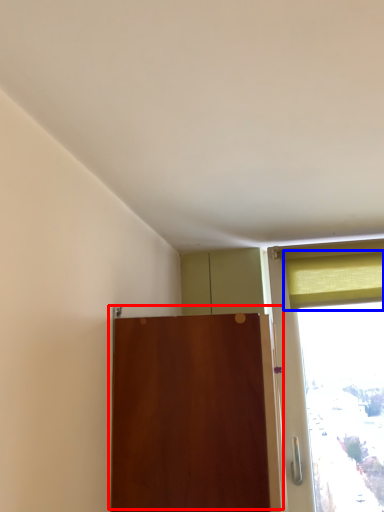
Question: Which object appears farthest to the camera in this image, door (highlighted by a red box) or curtain (highlighted by a blue box)?

Choices:
 (A) door
 (B) curtain

Answer: (B)